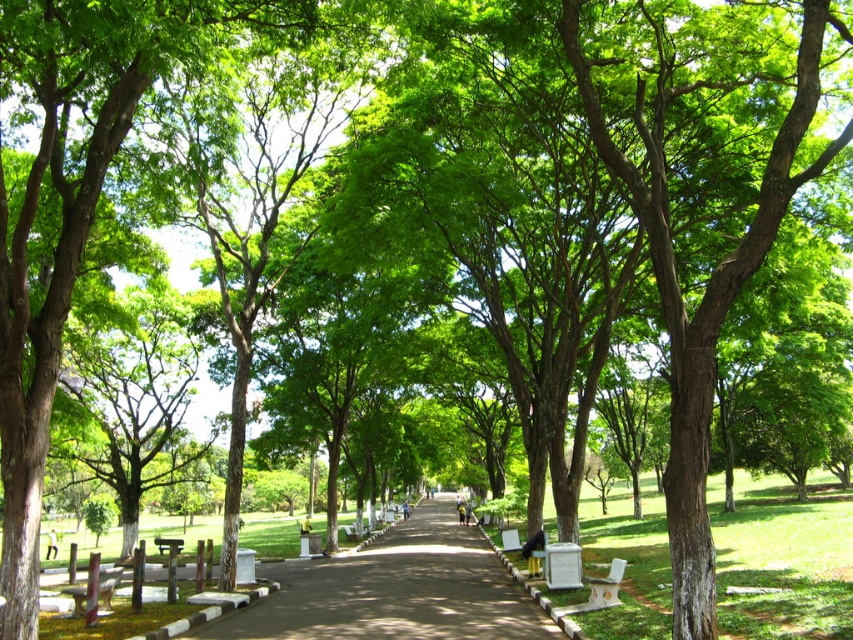
Question: Is brown asphalt road at center smaller than wooden park bench at center?

Choices:
 (A) yes
 (B) no

Answer: (A)

Question: Is brown asphalt road at center behind wooden park bench at center?

Choices:
 (A) yes
 (B) no

Answer: (B)

Question: Among these objects, which one is farthest from the camera?

Choices:
 (A) wooden park bench at center
 (B) brown asphalt road at center

Answer: (A)

Question: Does brown asphalt road at center come behind wooden park bench at center?

Choices:
 (A) no
 (B) yes

Answer: (A)

Question: Which point is closer to the camera?

Choices:
 (A) (426, 620)
 (B) (173, 541)

Answer: (A)

Question: Which point appears closest to the camera in this image?

Choices:
 (A) (167, 541)
 (B) (335, 634)

Answer: (B)